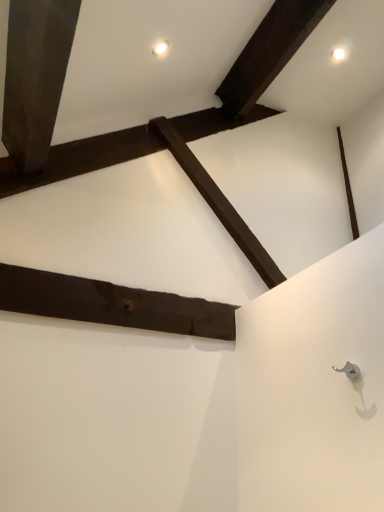
The width and height of the screenshot is (384, 512). Describe the element at coordinates (112, 304) in the screenshot. I see `dark brown wood plank at center` at that location.

What are the coordinates of `dark brown wood plank at center` in the screenshot? It's located at (112, 304).

In order to face dark brown wood plank at center, should I rotate leftwards or rightwards?

It's best to rotate left around 6.885 degrees.

I want to click on dark brown wood plank at center, so click(112, 304).